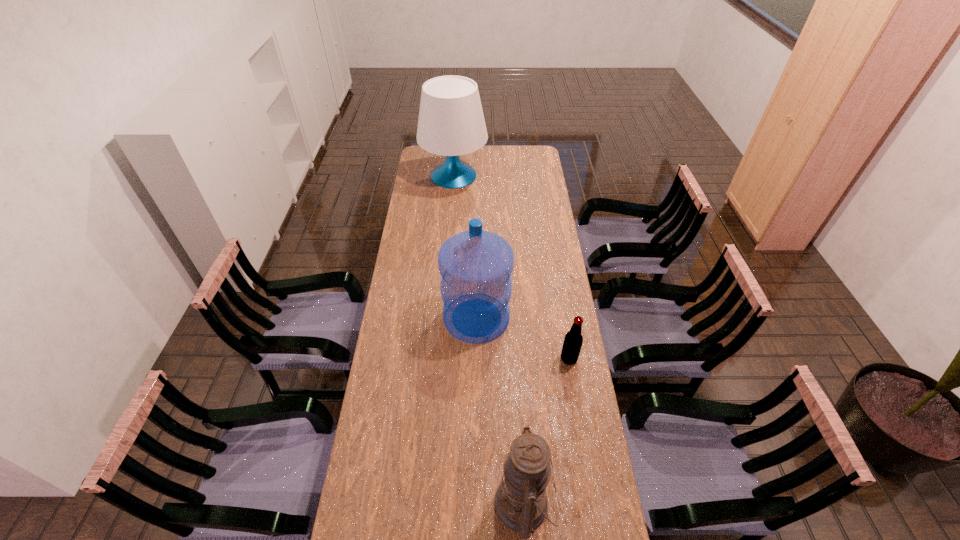
Locate an element on the screen. The image size is (960, 540). table lamp is located at coordinates (451, 122).

Find the location of a particular element. water jug is located at coordinates (476, 265).

Identify the location of beer bottle. The image size is (960, 540). (573, 340).

In order to click on the rightmost object in this screenshot , I will do `click(573, 340)`.

You are a GUI agent. You are given a task and a screenshot of the screen. Output one action in this format:
    pyautogui.click(x=<x>, y=<y>)
    Task: Click on the free location located on the front-facing side of the table lamp
    
    Given the screenshot: What is the action you would take?
    pyautogui.click(x=450, y=233)

Image resolution: width=960 pixels, height=540 pixels. I want to click on vacant space located on the right of the water jug, so click(535, 318).

Image resolution: width=960 pixels, height=540 pixels. Find the location of `vacant area located 0.150m on the front of the beer bottle`. vacant area located 0.150m on the front of the beer bottle is located at coordinates (576, 404).

Where is `object present at the far edge`? object present at the far edge is located at coordinates (451, 122).

Locate an element on the screen. This screenshot has height=540, width=960. object positioned at the left edge is located at coordinates click(x=451, y=122).

You are a GUI agent. You are given a task and a screenshot of the screen. Output one action in this format:
    pyautogui.click(x=<x>, y=<y>)
    Task: Click on the object that is at the right edge
    The height and width of the screenshot is (540, 960).
    Given the screenshot: What is the action you would take?
    pyautogui.click(x=573, y=340)